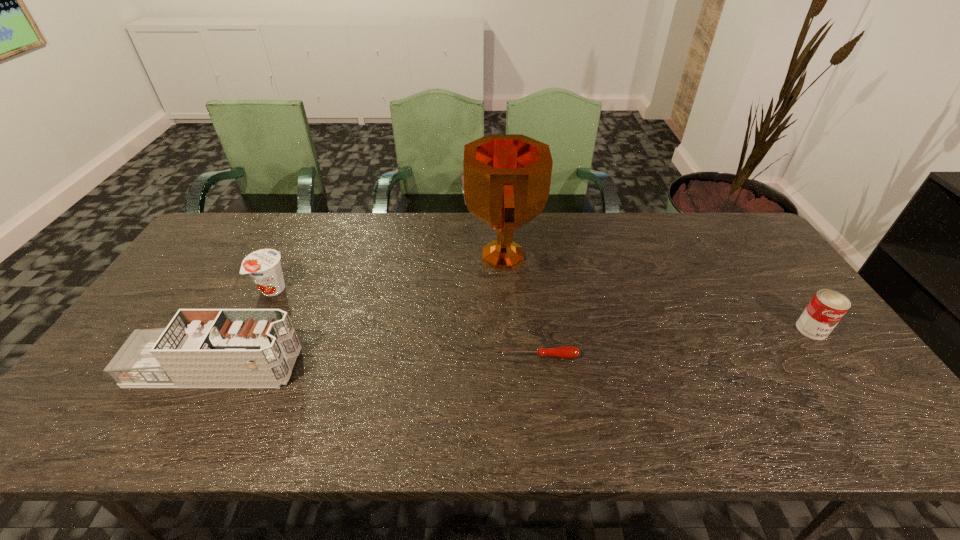
The width and height of the screenshot is (960, 540). I want to click on free location that satisfies the following two spatial constraints: 1. on the front label of the rightmost object; 2. at the entrance of the dollhouse, so click(840, 368).

This screenshot has width=960, height=540. In order to click on vacant space that satisfies the following two spatial constraints: 1. on the front side of the shortest object; 2. at the entrance of the dollhouse in this screenshot , I will do `click(540, 368)`.

Locate an element on the screen. vacant region that satisfies the following two spatial constraints: 1. on the front side of the yogurt; 2. at the entrance of the dollhouse is located at coordinates (233, 368).